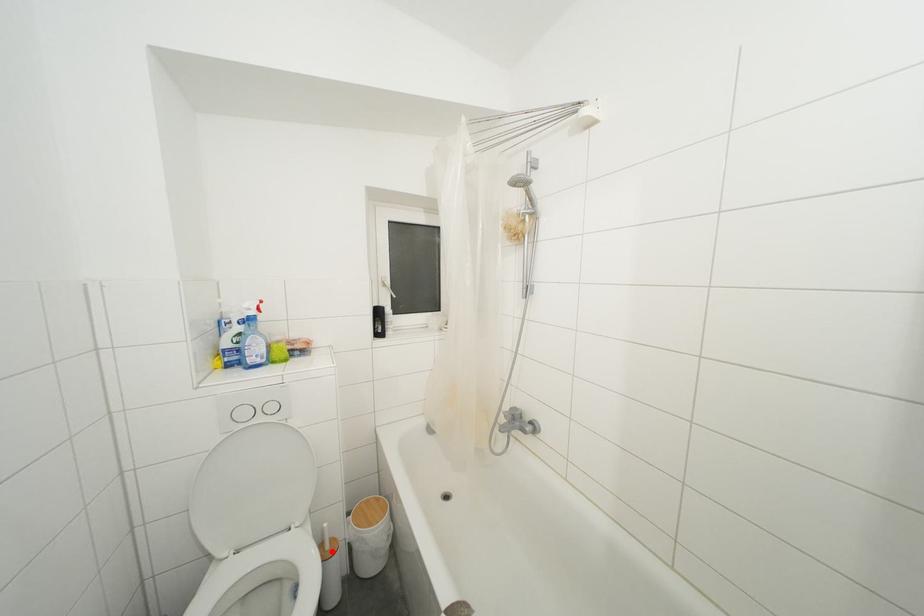
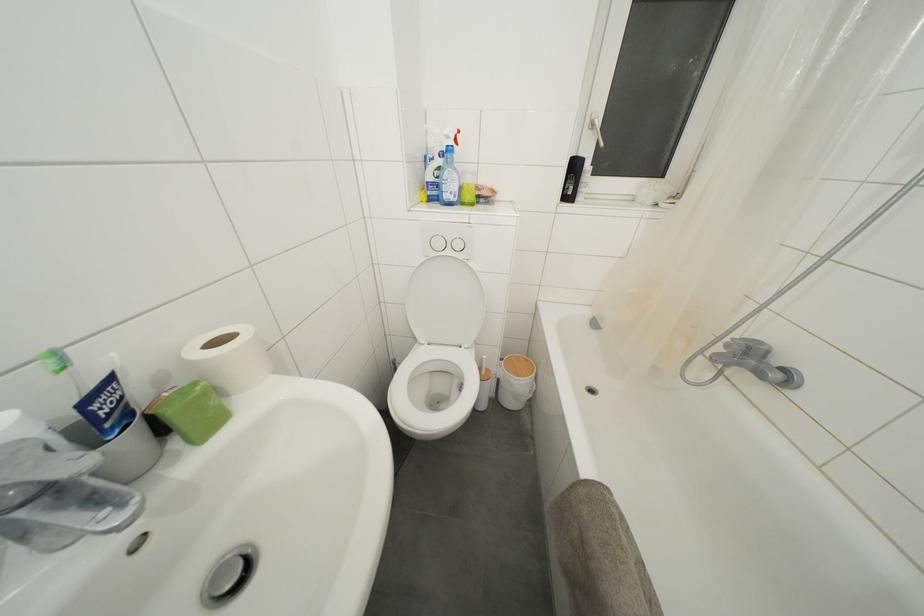
In the second image, find the point that corresponds to the highlighted location in the first image.

(488, 378)